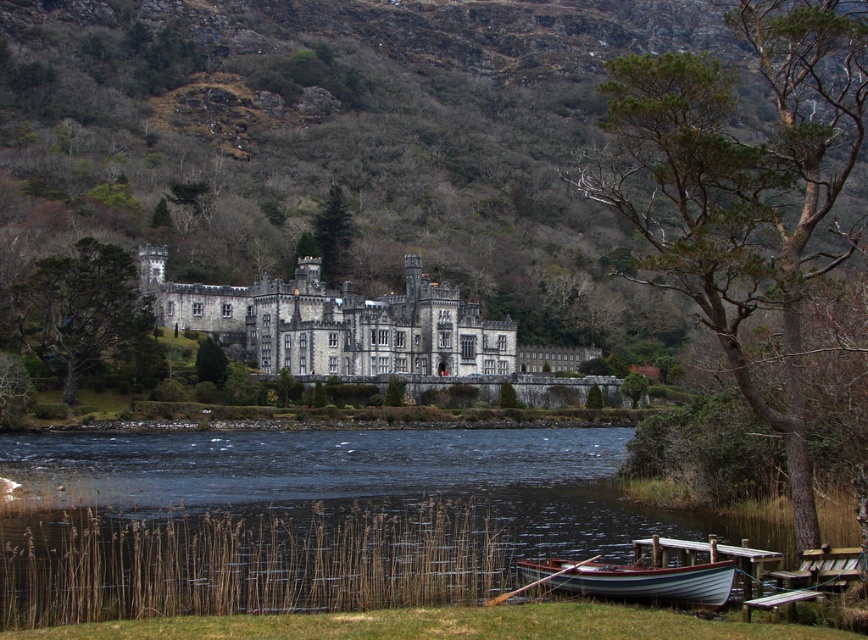
Which is more to the right, green textured tree at left or green matte tree at upper center?

green matte tree at upper center

Locate an element on the screen. green textured tree at left is located at coordinates (79, 308).

Where is `green textured tree at left`? This screenshot has width=868, height=640. green textured tree at left is located at coordinates (79, 308).

Does point (81, 268) come farther from viewer compared to point (201, 372)?

No, (81, 268) is closer to viewer.

Can you confirm if green textured tree at left is taller than green leafy tree at center?

Yes.

Does point (23, 285) come behind point (207, 355)?

No, it is not.

You are a GUI agent. You are given a task and a screenshot of the screen. Output one action in this format:
    pyautogui.click(x=<x>, y=<y>)
    Task: Click on the green textured tree at left
    
    Given the screenshot: What is the action you would take?
    pyautogui.click(x=79, y=308)

Who is shorter, gray stone castle at center or wooden boat at lower center?

wooden boat at lower center

The width and height of the screenshot is (868, 640). Find the location of `gray stone castle at center`. gray stone castle at center is located at coordinates (334, 323).

Find the location of a particular element. The width and height of the screenshot is (868, 640). gray stone castle at center is located at coordinates coord(334,323).